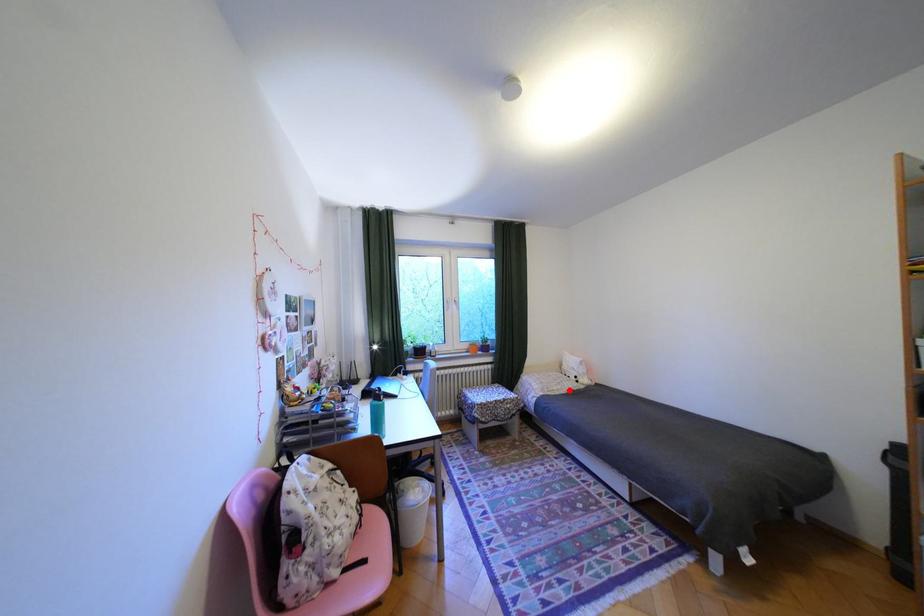
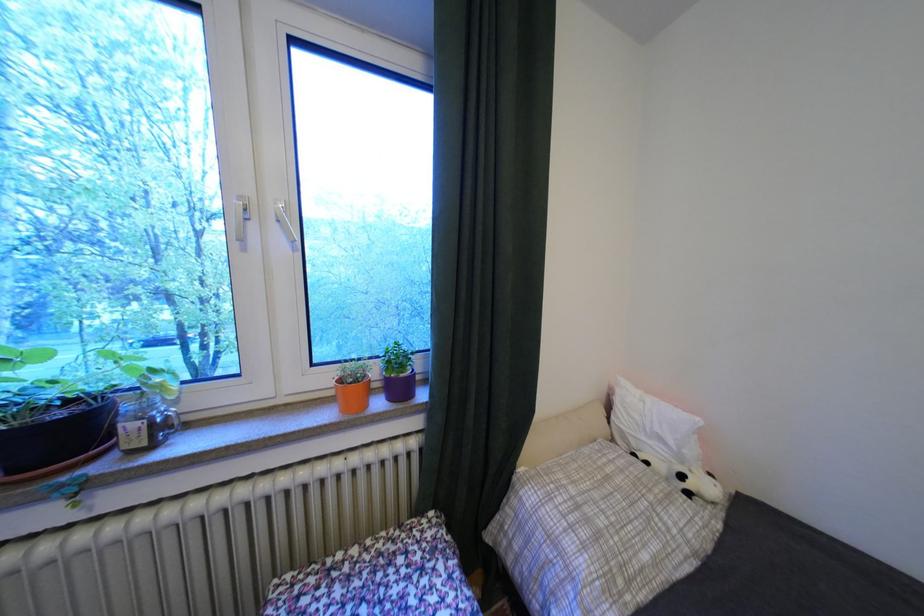
Question: I am providing you with two images of the same scene from different viewpoints. Image1 has a red point marked. In image2, the corresponding 3D location appears at what relative position? Reply with the corresponding letter.

Choices:
 (A) Closer
 (B) Farther

Answer: (A)